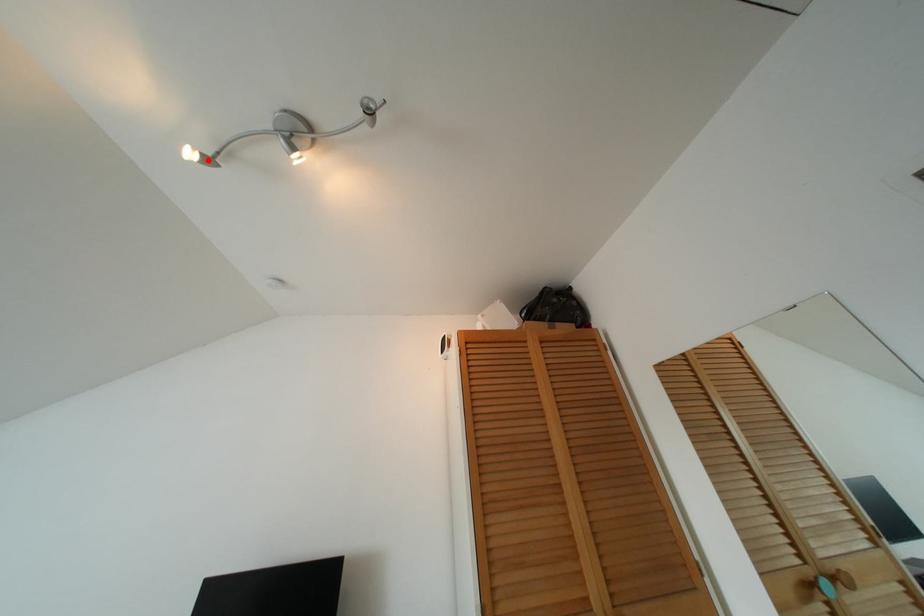
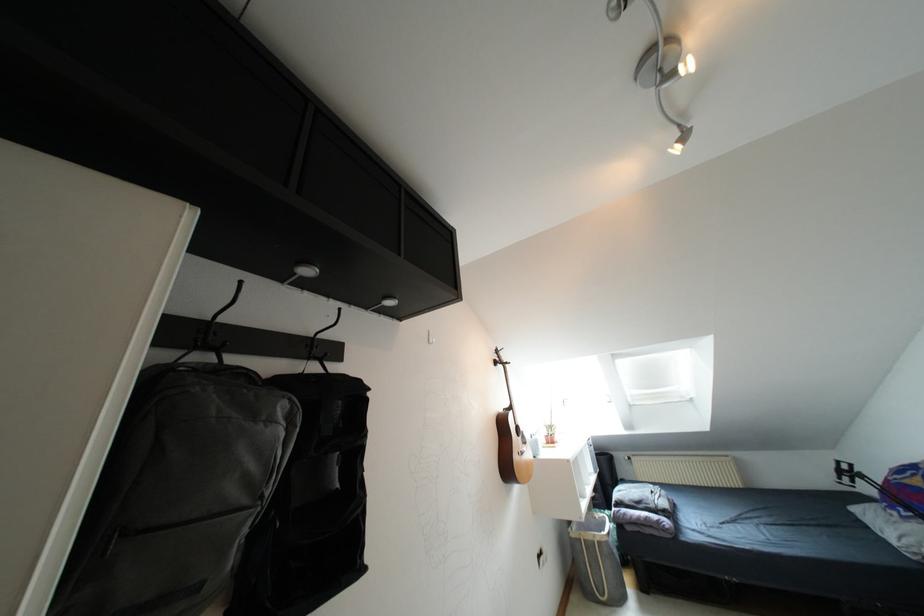
Find the pixel in the second image that matches the highlighted location in the first image.

(683, 138)